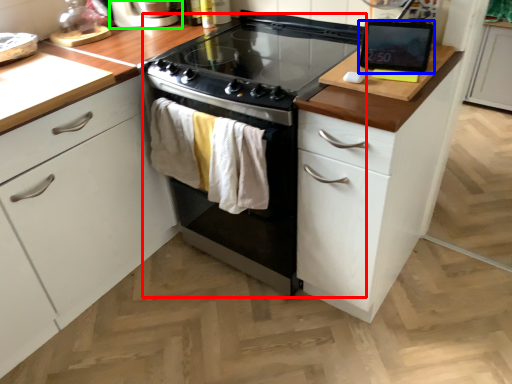
Question: Which object is positioned farthest from oven (highlighted by a red box)? Select from kitchen appliance (highlighted by a blue box) and home appliance (highlighted by a green box).

Choices:
 (A) kitchen appliance
 (B) home appliance

Answer: (B)